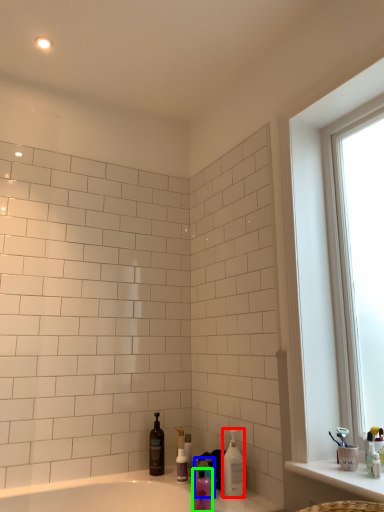
Question: Estimate the real-world distances between objects in this image. Which object is closer to cleaning product (highlighted by a red box), cleaning product (highlighted by a blue box) or mouthwash (highlighted by a green box)?

Choices:
 (A) cleaning product
 (B) mouthwash

Answer: (A)